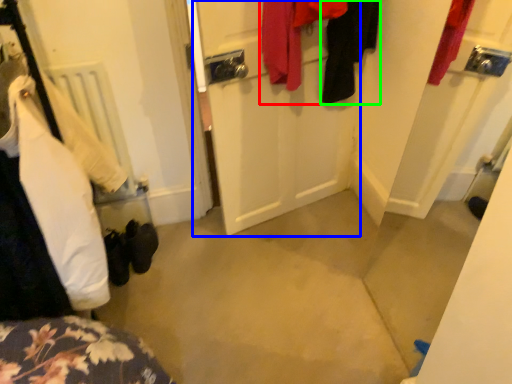
Question: Which object is the farthest from clothing (highlighted by a red box)? Choose among these: door (highlighted by a blue box) or clothing (highlighted by a green box).

Choices:
 (A) door
 (B) clothing

Answer: (A)